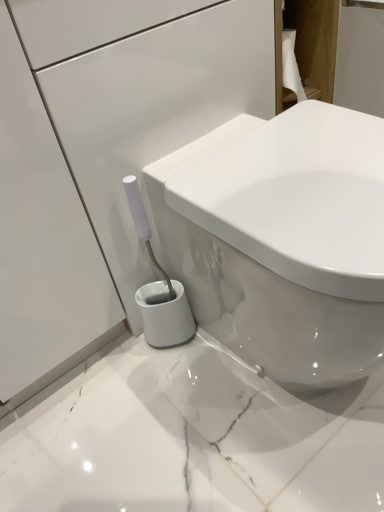
The height and width of the screenshot is (512, 384). Identify the location of free spot above white glossy toilet at center (from a real-world perspective). click(x=311, y=161).